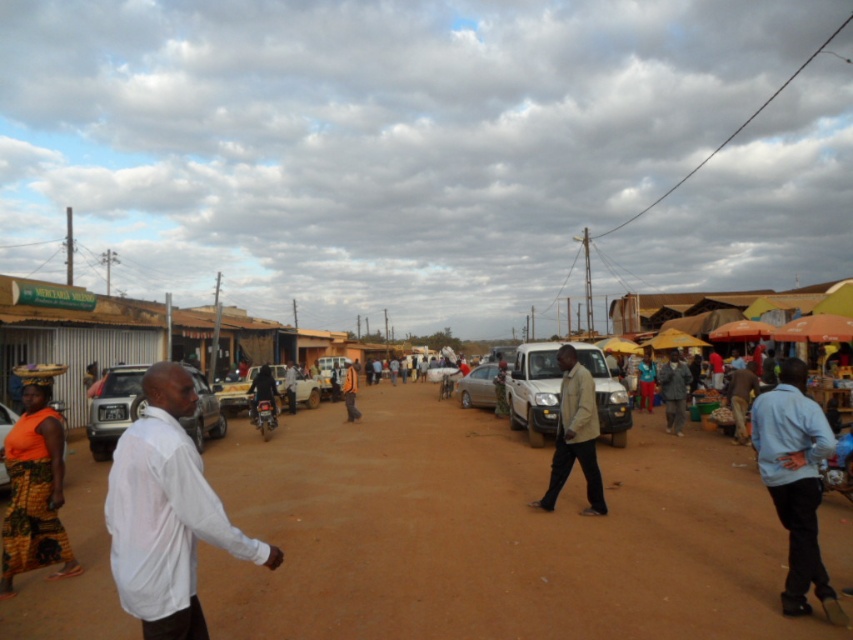
Does light blue shirt at right have a larger size compared to silver metallic car at center-left?

Indeed, light blue shirt at right has a larger size compared to silver metallic car at center-left.

Does point (792, 387) lie in front of point (120, 388)?

Yes.

In order to click on light blue shirt at right in this screenshot , I will do `click(795, 483)`.

Can you confirm if light blue shirt at right is positioned above orange fabric at center?

Yes, light blue shirt at right is above orange fabric at center.

Does light blue shirt at right lie in front of orange fabric at center?

Yes, light blue shirt at right is in front of orange fabric at center.

Between point (752, 403) and point (347, 365), which one is positioned behind?

Point (347, 365)

In order to click on light blue shirt at right in this screenshot , I will do `click(795, 483)`.

Which is behind, point (527, 406) or point (354, 380)?

Point (354, 380)

Which is in front, point (519, 392) or point (347, 380)?

Positioned in front is point (519, 392).

Is point (519, 419) positioned in front of point (351, 376)?

That is True.

This screenshot has width=853, height=640. I want to click on white matte van at center, so pos(534,390).